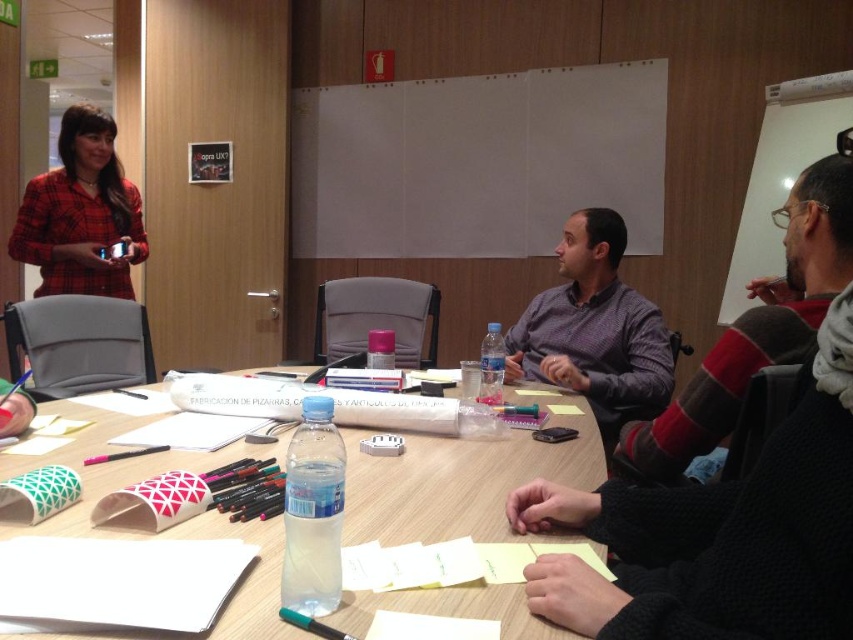
The image size is (853, 640). What do you see at coordinates (595, 330) in the screenshot? I see `matte purple shirt at center` at bounding box center [595, 330].

Who is more distant from viewer, (x=584, y=211) or (x=56, y=198)?

Point (x=56, y=198)

Is point (602, 396) closer to viewer compared to point (67, 225)?

Yes, point (602, 396) is closer to viewer.

You are a GUI agent. You are given a task and a screenshot of the screen. Output one action in this format:
    pyautogui.click(x=<x>, y=<y>)
    Task: Click on the matte purple shirt at center
    Image resolution: width=853 pixels, height=640 pixels.
    Given the screenshot: What is the action you would take?
    pyautogui.click(x=595, y=330)

Can you confirm if wooden table at center is wider than matte purple shirt at center?

Correct, the width of wooden table at center exceeds that of matte purple shirt at center.

Between wooden table at center and matte purple shirt at center, which one is positioned lower?

wooden table at center is lower down.

In order to click on wooden table at center in this screenshot , I will do `click(457, 483)`.

Find the location of a particular element. The image size is (853, 640). wooden table at center is located at coordinates (457, 483).

Is point (527, 477) in front of point (68, 147)?

Yes, point (527, 477) is in front of point (68, 147).

Image resolution: width=853 pixels, height=640 pixels. I want to click on wooden table at center, so (x=457, y=483).